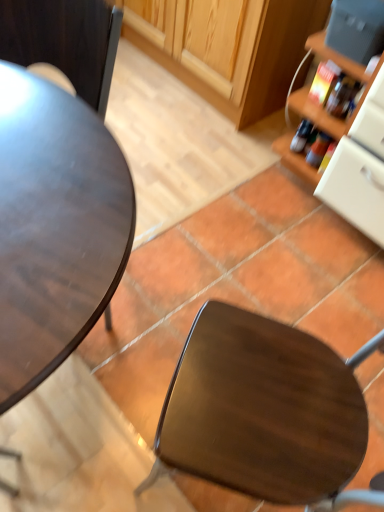
Where is `free space behind shiny brown chair at center`? This screenshot has width=384, height=512. free space behind shiny brown chair at center is located at coordinates (251, 300).